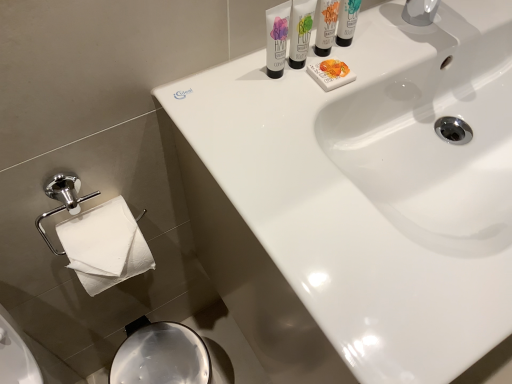
You are a GUI agent. You are given a task and a screenshot of the screen. Output one action in this format:
    pyautogui.click(x=<x>, y=<y>)
    Task: Click on the spots to the right of white matte soap at upper center
    The width and height of the screenshot is (512, 384).
    Given the screenshot: What is the action you would take?
    pyautogui.click(x=402, y=53)